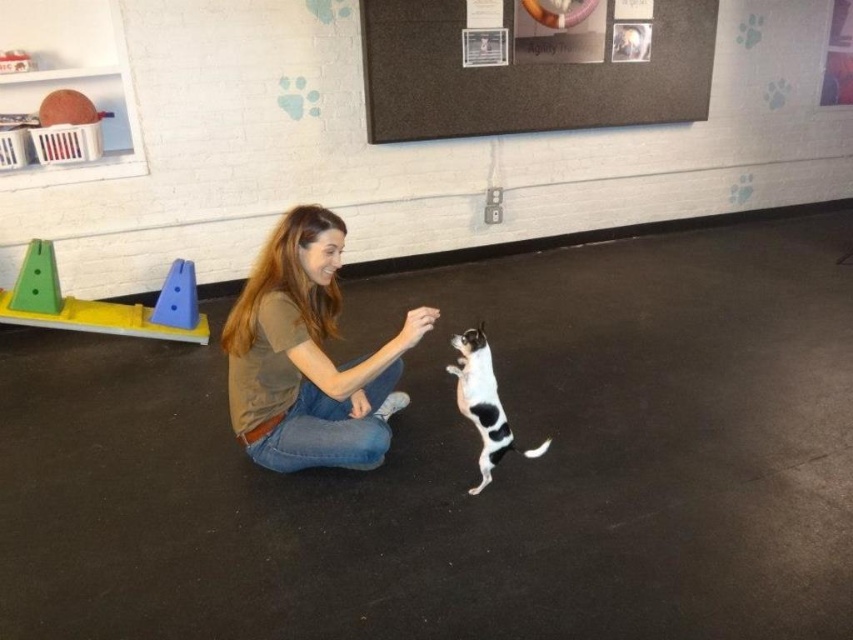
Which of these two, dark gray matte bulletin board at upper center or smooth plastic cones at left, stands taller?

dark gray matte bulletin board at upper center

The width and height of the screenshot is (853, 640). What are the coordinates of `dark gray matte bulletin board at upper center` in the screenshot? It's located at (523, 76).

Does brown cotton shirt at center have a greater height compared to black and white fur cat at center?

Yes, brown cotton shirt at center is taller than black and white fur cat at center.

Based on the photo, does brown cotton shirt at center appear on the left side of black and white fur cat at center?

Indeed, brown cotton shirt at center is positioned on the left side of black and white fur cat at center.

This screenshot has width=853, height=640. In order to click on brown cotton shirt at center in this screenshot , I will do `click(308, 356)`.

At what (x,y) coordinates should I click in order to perform the action: click on brown cotton shirt at center. Please return your answer as a coordinate pair (x, y). The width and height of the screenshot is (853, 640). Looking at the image, I should click on (308, 356).

Who is positioned more to the right, smooth plastic cones at left or black and white fur cat at center?

black and white fur cat at center is more to the right.

Is smooth plastic cones at left to the right of black and white fur cat at center from the viewer's perspective?

Incorrect, smooth plastic cones at left is not on the right side of black and white fur cat at center.

What do you see at coordinates (102, 304) in the screenshot?
I see `smooth plastic cones at left` at bounding box center [102, 304].

Where is `smooth plastic cones at left`? The height and width of the screenshot is (640, 853). smooth plastic cones at left is located at coordinates tap(102, 304).